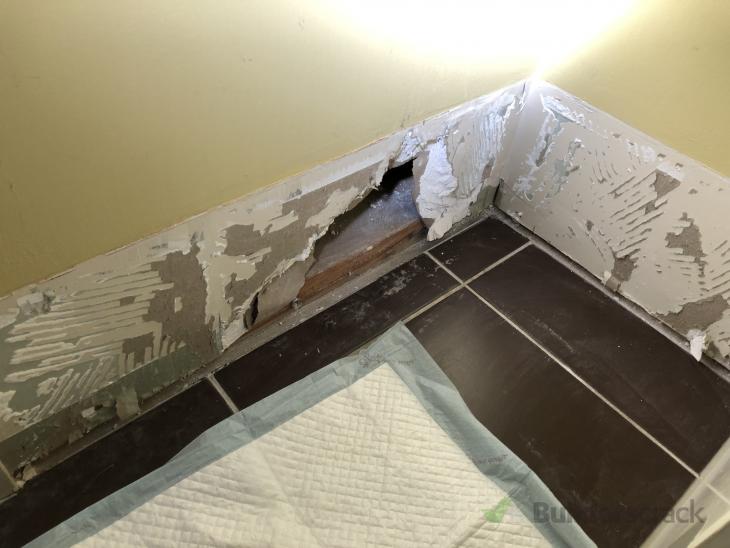
You are a GUI agent. You are given a task and a screenshot of the screen. Output one action in this format:
    pyautogui.click(x=<x>, y=<y>)
    Task: Click on the stain
    
    Given the screenshot: What is the action you would take?
    pyautogui.click(x=496, y=515)